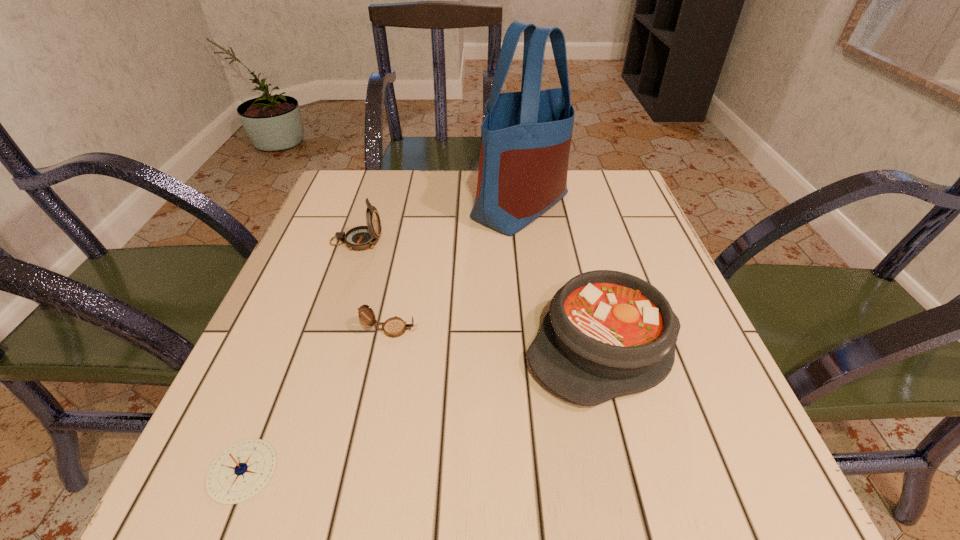
Identify the location of vacant point located between the handbag and the casserole. Image resolution: width=960 pixels, height=540 pixels. (563, 275).

In order to click on vacant point located between the third object from right to left and the handbag in this screenshot , I will do `click(456, 267)`.

At what (x,y) coordinates should I click in order to perform the action: click on unoccupied area between the casserole and the nearest object. Please return your answer as a coordinate pair (x, y). This screenshot has width=960, height=540. Looking at the image, I should click on (423, 409).

Find the location of a particular element. the fourth closest object to the tallest compass is located at coordinates (241, 471).

Find the location of a particular element. This screenshot has width=960, height=540. object that is the third closest to the handbag is located at coordinates (393, 327).

Select which compass appears as the second closest to the nearest object. Please provide its 2D coordinates. Your answer should be formatted as a tuple, i.e. [(x, y)], where the tuple contains the x and y coordinates of a point satisfying the conditions above.

[(359, 238)]

The height and width of the screenshot is (540, 960). Identify the location of compass identified as the second closest to the farthest compass. (241, 471).

What are the coordinates of `free spot that satisfies the following two spatial constraints: 1. on the face of the rightmost compass; 2. on the back side of the casserole` in the screenshot? It's located at (387, 347).

You are a GUI agent. You are given a task and a screenshot of the screen. Output one action in this format:
    pyautogui.click(x=<x>, y=<y>)
    Task: Click on the free space that satisfies the following two spatial constraints: 1. on the front side of the casserole; 2. on the right side of the tallest object
    
    Given the screenshot: What is the action you would take?
    pyautogui.click(x=539, y=347)

Find the location of a particular element. Image resolution: width=960 pixels, height=540 pixels. vacant position in the image that satisfies the following two spatial constraints: 1. on the face of the farthest compass; 2. on the front side of the nearest compass is located at coordinates (278, 471).